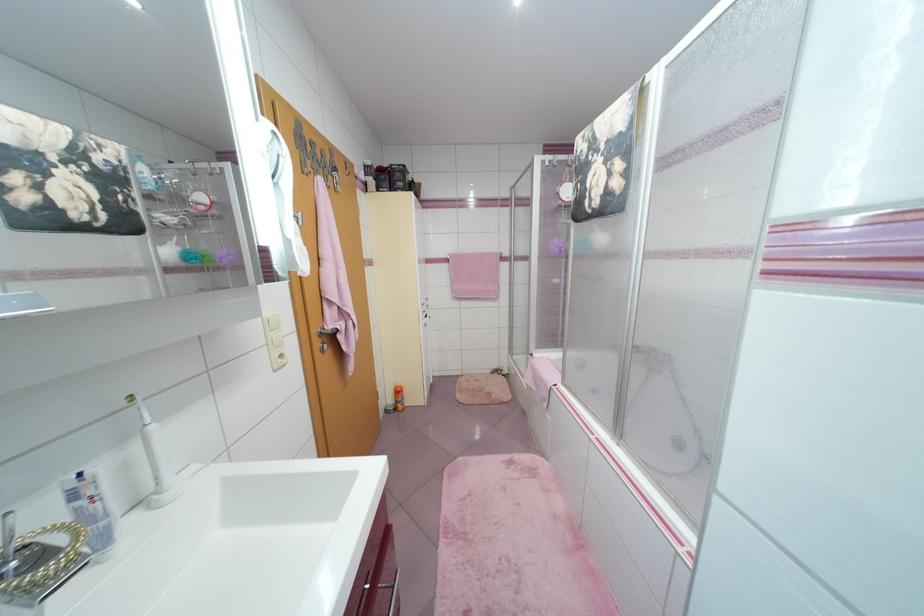
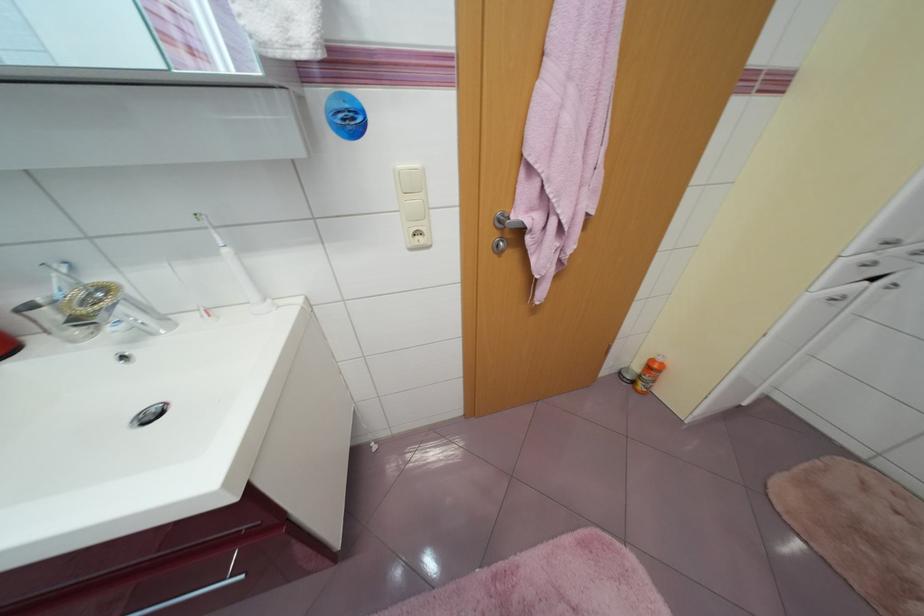
In the second image, find the point that corresponds to point (400, 410) in the first image.

(638, 383)